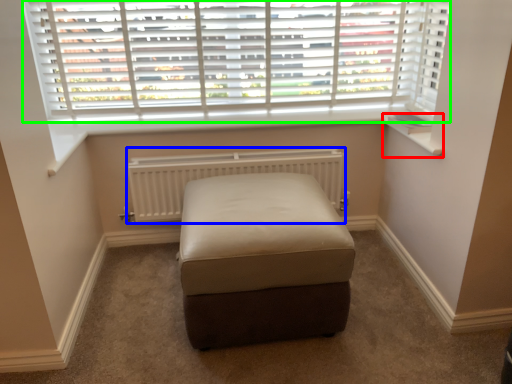
Question: Estimate the real-world distances between objects in this image. Which object is closer to window sill (highlighted by a red box), radiator (highlighted by a blue box) or window (highlighted by a green box)?

Choices:
 (A) radiator
 (B) window

Answer: (A)